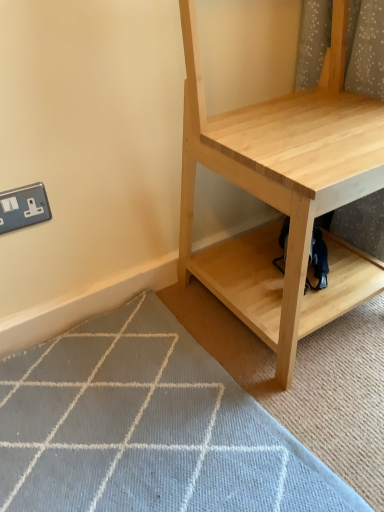
Question: From the image's perspective, would you say light gray woven mat at lower left is shown under dark blue fabric swivel chair at lower center?

Choices:
 (A) yes
 (B) no

Answer: (A)

Question: Is light gray woven mat at lower left in front of dark blue fabric swivel chair at lower center?

Choices:
 (A) yes
 (B) no

Answer: (A)

Question: Is light gray woven mat at lower left to the right of dark blue fabric swivel chair at lower center from the viewer's perspective?

Choices:
 (A) yes
 (B) no

Answer: (B)

Question: Considering the relative sizes of light gray woven mat at lower left and dark blue fabric swivel chair at lower center in the image provided, is light gray woven mat at lower left thinner than dark blue fabric swivel chair at lower center?

Choices:
 (A) no
 (B) yes

Answer: (A)

Question: Does light gray woven mat at lower left turn towards dark blue fabric swivel chair at lower center?

Choices:
 (A) yes
 (B) no

Answer: (B)

Question: Are light gray woven mat at lower left and dark blue fabric swivel chair at lower center beside each other?

Choices:
 (A) no
 (B) yes

Answer: (A)

Question: Is dark blue fabric swivel chair at lower center further to camera compared to natural wood shelf at center?

Choices:
 (A) no
 (B) yes

Answer: (B)

Question: Does dark blue fabric swivel chair at lower center lie in front of natural wood shelf at center?

Choices:
 (A) yes
 (B) no

Answer: (B)

Question: Would you say dark blue fabric swivel chair at lower center is outside natural wood shelf at center?

Choices:
 (A) no
 (B) yes

Answer: (A)

Question: Is dark blue fabric swivel chair at lower center facing away from natural wood shelf at center?

Choices:
 (A) no
 (B) yes

Answer: (B)

Question: Can you confirm if dark blue fabric swivel chair at lower center is positioned to the left of natural wood shelf at center?

Choices:
 (A) yes
 (B) no

Answer: (B)

Question: Does dark blue fabric swivel chair at lower center have a lesser width compared to natural wood shelf at center?

Choices:
 (A) yes
 (B) no

Answer: (A)

Question: Is silver metallic electric outlet at lower left placed right next to natural wood shelf at center?

Choices:
 (A) yes
 (B) no

Answer: (B)